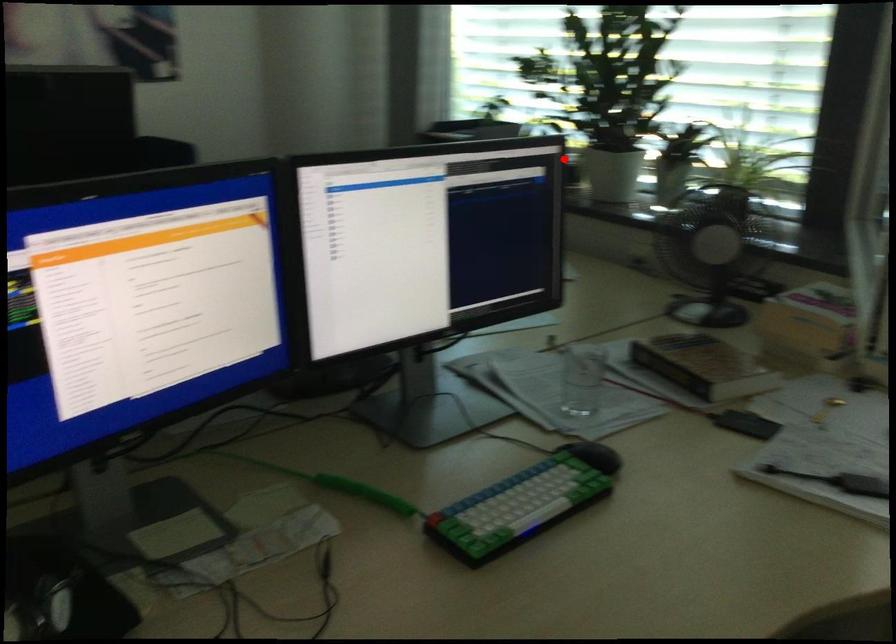
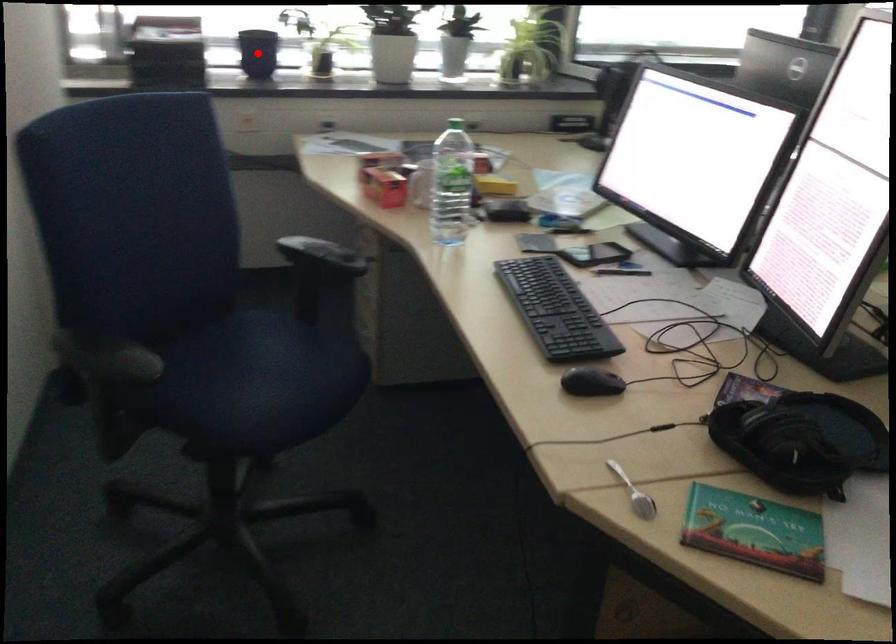
I am providing you with two images of the same scene from different viewpoints. A red point is marked on the first image and another point is marked on the second image. Is the red point in image1 aligned with the point shown in image2?

Yes